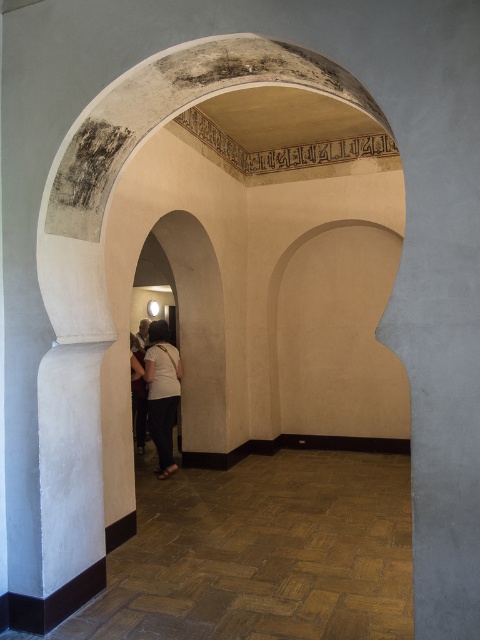
Who is higher up, brown parquet floor at lower center or white cotton shirt at center?

white cotton shirt at center is higher up.

Is brown parquet floor at lower center shorter than white cotton shirt at center?

Correct, brown parquet floor at lower center is not as tall as white cotton shirt at center.

Identify the location of brown parquet floor at lower center. The width and height of the screenshot is (480, 640). (263, 554).